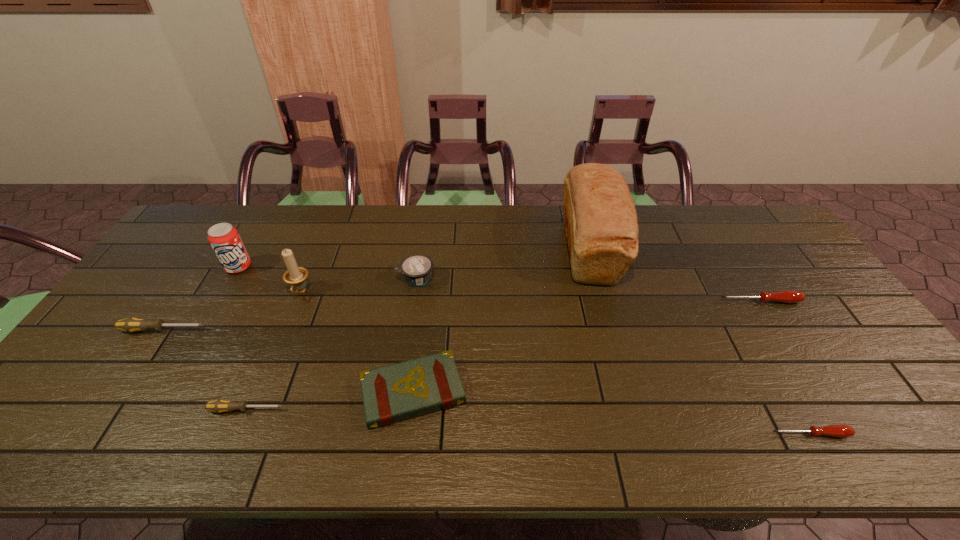
Locate an element on the screen. This screenshot has height=540, width=960. brown bread is located at coordinates (601, 225).

In order to click on bread in this screenshot , I will do `click(601, 225)`.

Locate an element on the screen. candle_holder is located at coordinates (296, 276).

Locate an element on the screen. The height and width of the screenshot is (540, 960). soda can is located at coordinates (223, 237).

Identify the location of yogurt. (417, 268).

Identify the location of the bigger gray screwdriver. (132, 324).

I want to click on the sixth farthest object, so click(132, 324).

This screenshot has width=960, height=540. Find the location of `the bigger red screwdriver`. the bigger red screwdriver is located at coordinates (784, 296).

The height and width of the screenshot is (540, 960). Identify the location of the farthest screwdriver. (784, 296).

You are a GUI agent. You are given a task and a screenshot of the screen. Output one action in this format:
    pyautogui.click(x=<x>, y=<y>)
    Task: Click on the brown book
    This screenshot has height=540, width=960.
    Given the screenshot: What is the action you would take?
    tap(400, 391)